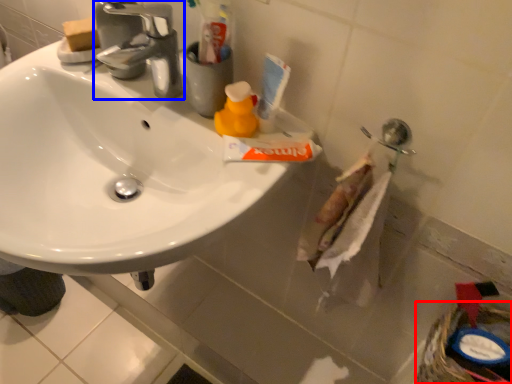
Question: Which point is closer to the camera, basket (highlighted by a red box) or tap (highlighted by a blue box)?

Choices:
 (A) basket
 (B) tap

Answer: (B)